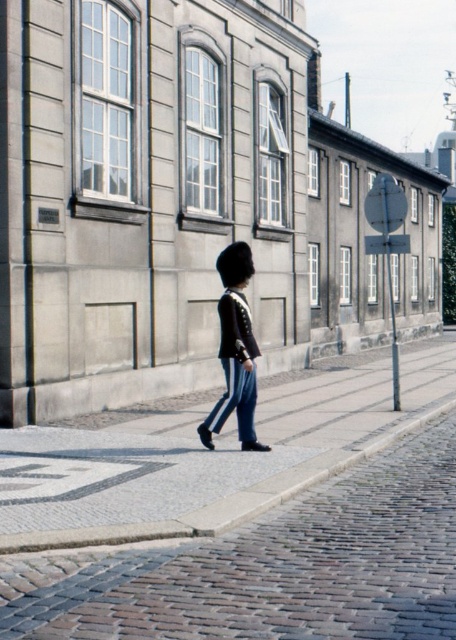
Question: Does cobblestone pavement at center appear on the left side of shiny black uniform at center?

Choices:
 (A) no
 (B) yes

Answer: (B)

Question: Can you confirm if cobblestone pavement at center is positioned above shiny black uniform at center?

Choices:
 (A) no
 (B) yes

Answer: (A)

Question: Which object appears farthest from the camera in this image?

Choices:
 (A) cobblestone pavement at center
 (B) shiny black uniform at center

Answer: (B)

Question: Considering the relative positions of cobblestone pavement at center and shiny black uniform at center in the image provided, where is cobblestone pavement at center located with respect to shiny black uniform at center?

Choices:
 (A) above
 (B) below

Answer: (B)